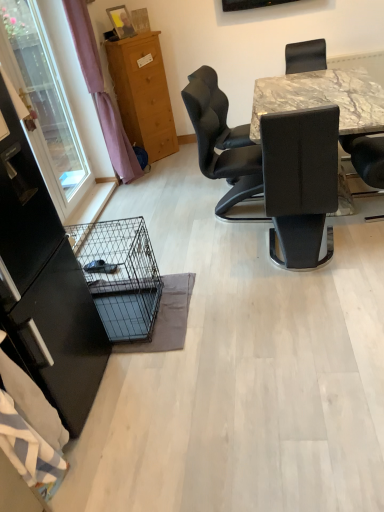
Question: From the image's perspective, is black wire mesh cage at lower left located above wooden cabinet at upper left?

Choices:
 (A) no
 (B) yes

Answer: (A)

Question: From a real-world perspective, is black wire mesh cage at lower left physically above wooden cabinet at upper left?

Choices:
 (A) yes
 (B) no

Answer: (B)

Question: Considering the relative sizes of black wire mesh cage at lower left and wooden cabinet at upper left in the image provided, is black wire mesh cage at lower left shorter than wooden cabinet at upper left?

Choices:
 (A) yes
 (B) no

Answer: (A)

Question: Considering the relative sizes of black wire mesh cage at lower left and wooden cabinet at upper left in the image provided, is black wire mesh cage at lower left bigger than wooden cabinet at upper left?

Choices:
 (A) yes
 (B) no

Answer: (B)

Question: Is black wire mesh cage at lower left completely or partially outside of wooden cabinet at upper left?

Choices:
 (A) yes
 (B) no

Answer: (A)

Question: Is black wire mesh cage at lower left positioned with its back to wooden cabinet at upper left?

Choices:
 (A) yes
 (B) no

Answer: (B)

Question: Considering the relative sizes of wooden cabinet at upper left and marble table at upper right in the image provided, is wooden cabinet at upper left thinner than marble table at upper right?

Choices:
 (A) no
 (B) yes

Answer: (B)

Question: Is wooden cabinet at upper left looking in the opposite direction of marble table at upper right?

Choices:
 (A) yes
 (B) no

Answer: (B)

Question: From the image's perspective, is wooden cabinet at upper left below marble table at upper right?

Choices:
 (A) yes
 (B) no

Answer: (B)

Question: Is wooden cabinet at upper left to the right of marble table at upper right from the viewer's perspective?

Choices:
 (A) yes
 (B) no

Answer: (B)

Question: Can you confirm if wooden cabinet at upper left is bigger than marble table at upper right?

Choices:
 (A) yes
 (B) no

Answer: (B)

Question: Is wooden cabinet at upper left aimed at marble table at upper right?

Choices:
 (A) yes
 (B) no

Answer: (A)

Question: Is transparent plastic window screen at left taller than marble table at upper right?

Choices:
 (A) no
 (B) yes

Answer: (B)